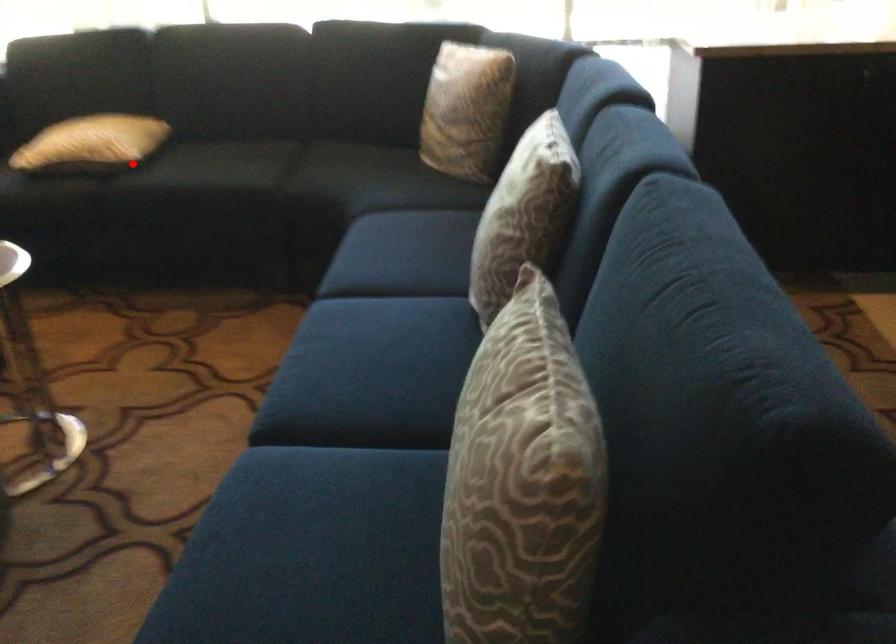
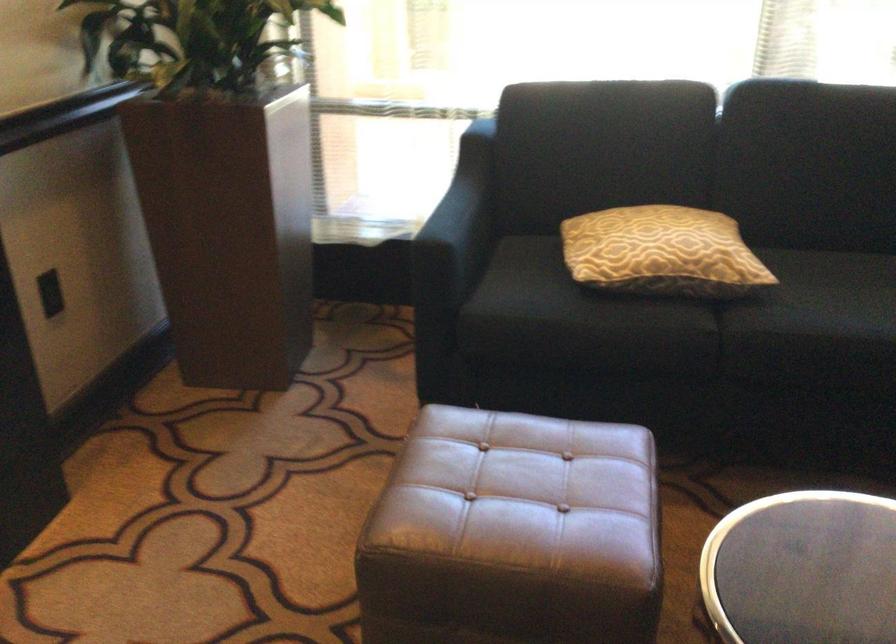
Question: I am providing you with two images of the same scene from different viewpoints. A red point is shown in image1. For the corresponding object point in image2, is it positioned nearer or farther from the camera?

Choices:
 (A) Nearer
 (B) Farther

Answer: (A)